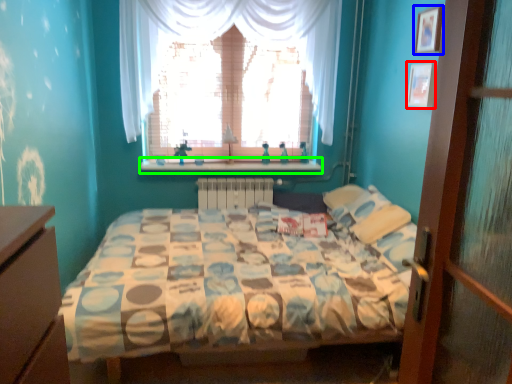
Question: Which object is positioned farthest from picture frame (highlighted by a red box)? Select from picture frame (highlighted by a blue box) and window sill (highlighted by a green box).

Choices:
 (A) picture frame
 (B) window sill

Answer: (B)